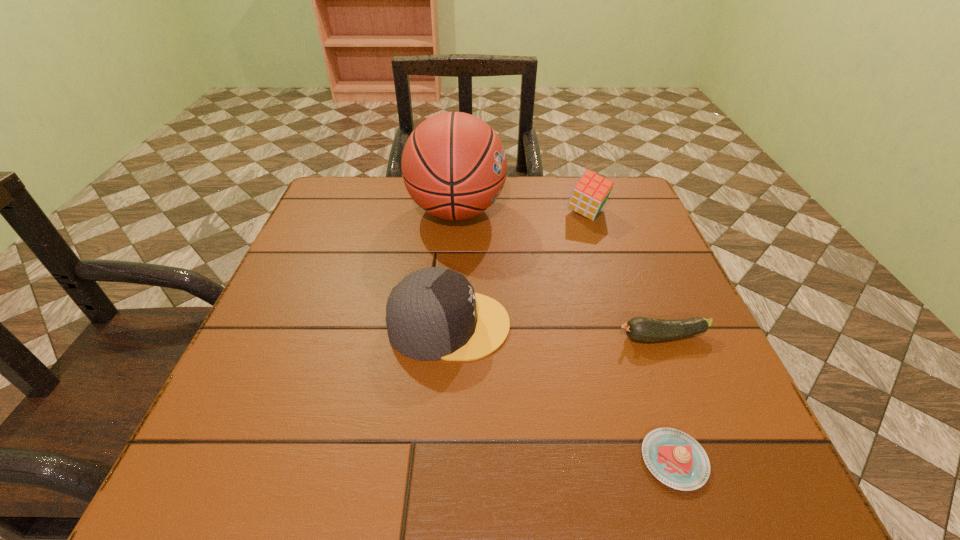
Image resolution: width=960 pixels, height=540 pixels. I want to click on object situated at the near right corner, so click(x=675, y=458).

Locate an element on the screen. vacant region at the far edge of the desktop is located at coordinates (554, 217).

This screenshot has height=540, width=960. In the image, there is a desktop. In order to click on free region at the near edge in this screenshot , I will do `click(389, 441)`.

Where is `free location at the left edge`? This screenshot has height=540, width=960. free location at the left edge is located at coordinates (283, 296).

Locate an element on the screen. The image size is (960, 540). blank space at the right edge is located at coordinates [x=722, y=403].

The width and height of the screenshot is (960, 540). In the image, there is a desktop. In order to click on vacant space at the far left corner in this screenshot , I will do `click(364, 213)`.

The height and width of the screenshot is (540, 960). I want to click on free space at the far right corner, so click(605, 214).

Find the location of a particular element. The width and height of the screenshot is (960, 540). free point between the tallest object and the cube is located at coordinates (521, 212).

This screenshot has width=960, height=540. I want to click on free space between the second shortest object and the nearest object, so click(x=668, y=399).

Find the location of `free space between the shortest object and the cap`. free space between the shortest object and the cap is located at coordinates pos(562,392).